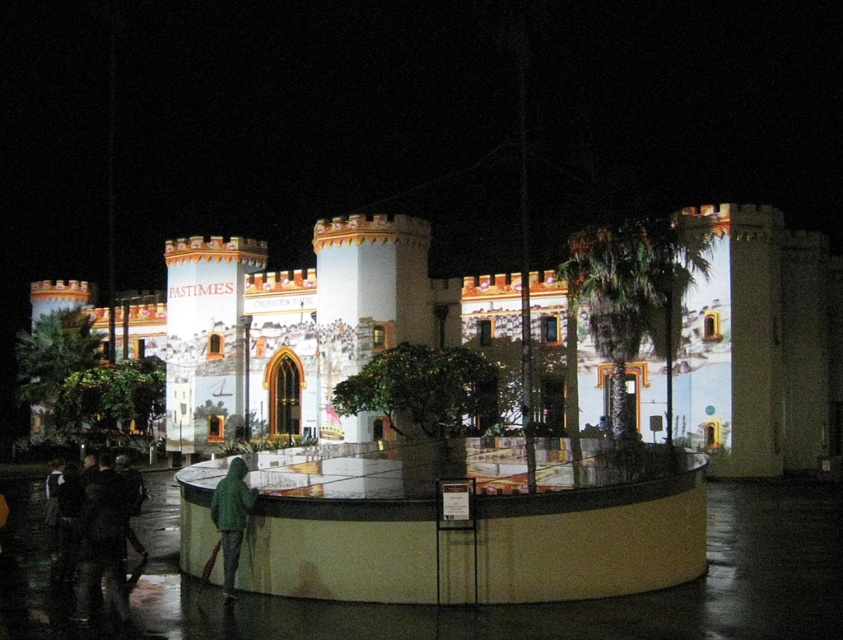
Between matte white castle at center and green matte jacket at lower left, which one has less height?

green matte jacket at lower left is shorter.

Who is positioned more to the left, matte white castle at center or green matte jacket at lower left?

matte white castle at center is more to the left.

Image resolution: width=843 pixels, height=640 pixels. Identify the location of matte white castle at center. (299, 324).